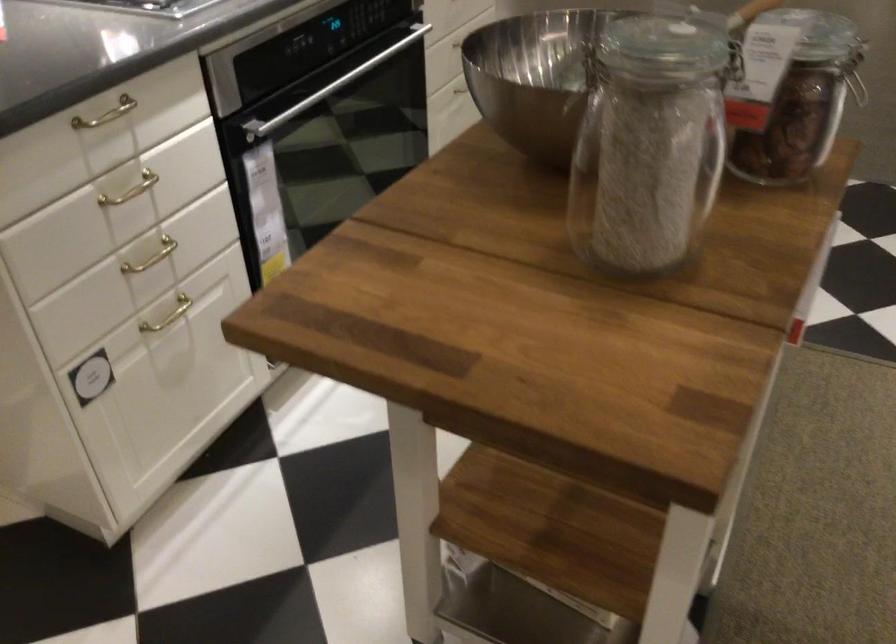
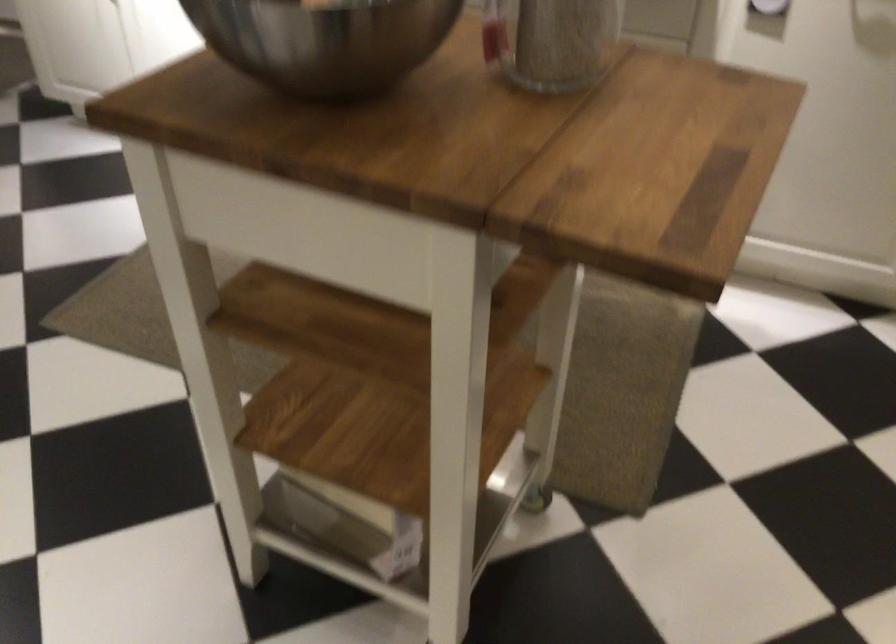
How did the camera likely rotate?

The camera rotated toward right-down.